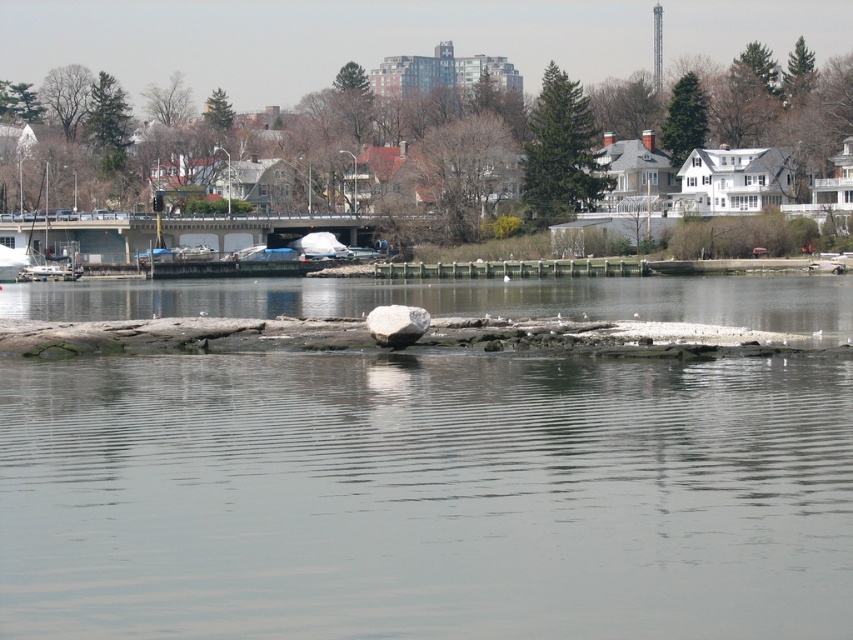
Is clear water at center behind matte white sailboat at left?

No, it is not.

Does point (218, 621) lie in front of point (59, 259)?

Yes, point (218, 621) is closer to viewer.

At what (x,y) coordinates should I click in order to perform the action: click on clear water at center. Please return your answer as a coordinate pair (x, y). Looking at the image, I should click on (425, 496).

Can you confirm if matte white sailboat at left is wider than gray smooth rock at center?

Yes.

Find the location of a particular element. This screenshot has height=640, width=853. matte white sailboat at left is located at coordinates (50, 246).

Does clear water at center appear on the right side of gray smooth rock at center?

Correct, you'll find clear water at center to the right of gray smooth rock at center.

Between point (795, 410) and point (381, 308), which one is positioned in front?

Positioned in front is point (795, 410).

Find the location of a particular element. clear water at center is located at coordinates (425, 496).